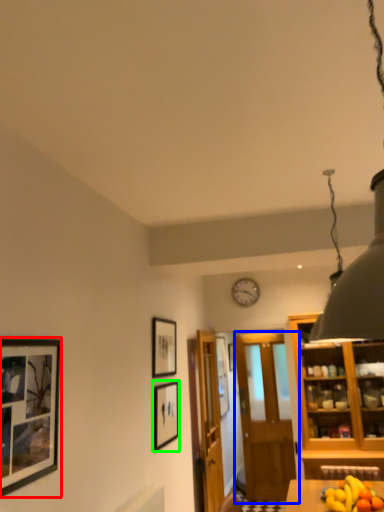
Question: Which is farther away from picture frame (highlighted by a red box)? door (highlighted by a blue box) or picture frame (highlighted by a green box)?

Choices:
 (A) door
 (B) picture frame

Answer: (A)